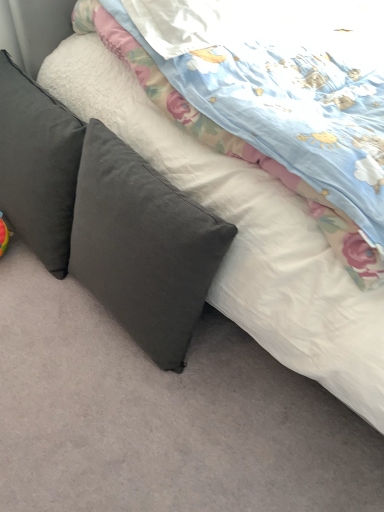
Question: Relative to dark gray fabric pillow at left, which ranks as the 1th pillow in right-to-left order, is dark gray fabric pillow at left, marked as the 1th pillow in a left-to-right arrangement, in front or behind?

Choices:
 (A) behind
 (B) front

Answer: (A)

Question: Considering the relative positions of dark gray fabric pillow at left, marked as the 2th pillow in a right-to-left arrangement, and dark gray fabric pillow at left, which ranks as the 1th pillow in right-to-left order, in the image provided, is dark gray fabric pillow at left, marked as the 2th pillow in a right-to-left arrangement, to the left or to the right of dark gray fabric pillow at left, which ranks as the 1th pillow in right-to-left order,?

Choices:
 (A) right
 (B) left

Answer: (B)

Question: Looking at their shapes, would you say dark gray fabric pillow at left, marked as the 1th pillow in a left-to-right arrangement, is wider or thinner than dark gray fabric pillow at left, the 2th pillow viewed from the left?

Choices:
 (A) thin
 (B) wide

Answer: (B)

Question: Does point (132, 285) appear closer or farther from the camera than point (43, 224)?

Choices:
 (A) farther
 (B) closer

Answer: (B)

Question: From the image's perspective, is dark gray fabric pillow at left, the 2th pillow viewed from the left, located above or below dark gray fabric pillow at left, marked as the 2th pillow in a right-to-left arrangement?

Choices:
 (A) above
 (B) below

Answer: (B)

Question: Choose the correct answer: Is dark gray fabric pillow at left, the 2th pillow viewed from the left, inside dark gray fabric pillow at left, marked as the 2th pillow in a right-to-left arrangement, or outside it?

Choices:
 (A) outside
 (B) inside

Answer: (A)

Question: Visually, is dark gray fabric pillow at left, the 2th pillow viewed from the left, positioned to the left or to the right of dark gray fabric pillow at left, marked as the 2th pillow in a right-to-left arrangement?

Choices:
 (A) right
 (B) left

Answer: (A)